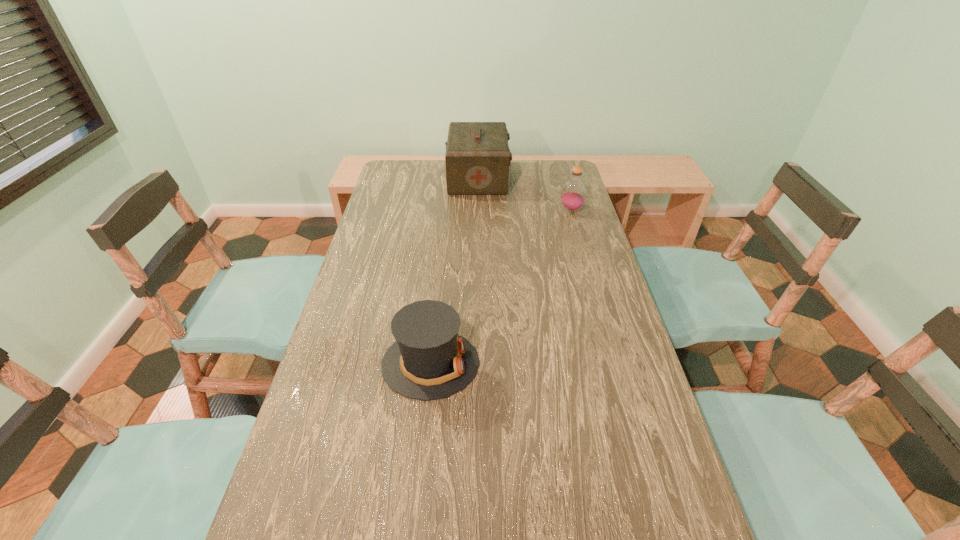
Where is `the farthest object`? The image size is (960, 540). the farthest object is located at coordinates (477, 158).

Identify the location of the first-aid kit. (477, 158).

I want to click on bottle, so click(573, 195).

Find the location of a particular element. The height and width of the screenshot is (540, 960). the rightmost object is located at coordinates (573, 195).

Image resolution: width=960 pixels, height=540 pixels. I want to click on dress hat, so click(x=429, y=360).

Identify the location of vacant space located on the front of the farthest object. The height and width of the screenshot is (540, 960). click(x=478, y=251).

Locate an element on the screen. The image size is (960, 540). vacant area situated on the front of the rightmost object is located at coordinates (591, 278).

This screenshot has width=960, height=540. I want to click on vacant space located 0.080m with goggles on the front of the dress hat, so click(511, 363).

Locate an element on the screen. object present at the far edge is located at coordinates (477, 158).

Where is `object that is positioned at the left edge`? Image resolution: width=960 pixels, height=540 pixels. object that is positioned at the left edge is located at coordinates (429, 360).